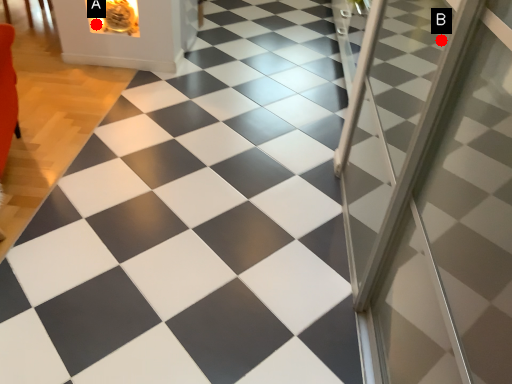
Question: Two points are circled on the image, labeled by A and B beside each circle. Among these points, which one is nearest to the camera?

Choices:
 (A) A is closer
 (B) B is closer

Answer: (B)